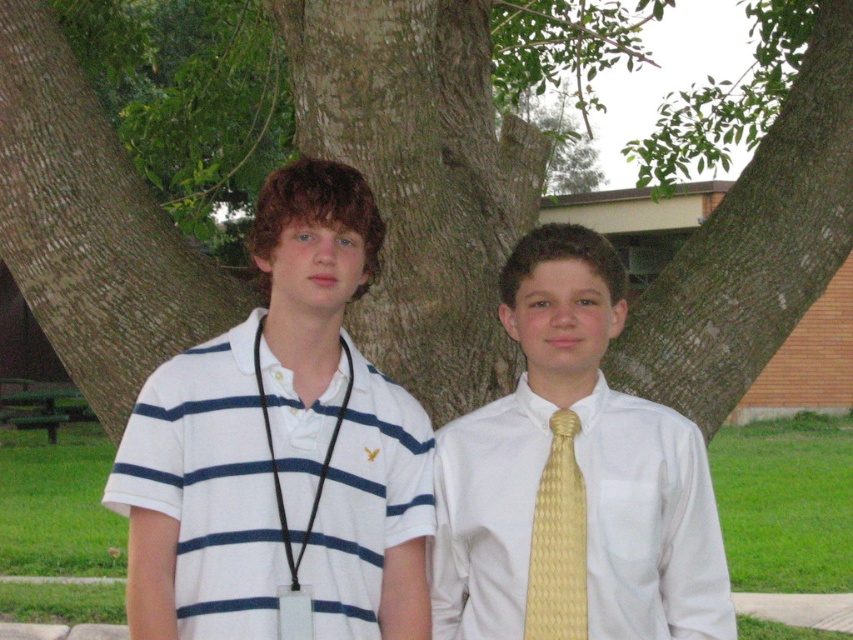
Consider the image. You are organizing a charity event and need to decide which item to place in a donation box. The donation box has a minimum size requirement of 15 cm in width. You have the white satin shirt at center and the yellow textured tie at center. Based on their sizes, which item is more likely to meet the requirement?

The white satin shirt at center is bigger than the yellow textured tie at center, so the white satin shirt at center is more likely to meet the 15 cm width requirement.

You are standing in the scene and want to take a photo of the green bark tree at center. If you are using a camera with a 100mm lens, which has a field of view of 24 degrees, can you fit the entire tree into your frame without moving closer or further away?

The question cannot be answered with the provided information because the description only provides the 2D location of the green bark tree at center, not its size or distance from the camera.

You are a photographer trying to capture both the white striped polo shirt at left and the white satin shirt at center in a single shot. Which shirt should you focus on first to ensure both are in focus?

You should focus on the white satin shirt at center first because it is farther away from the viewer than the white striped polo shirt at left, so adjusting focus from there will help both be in focus.